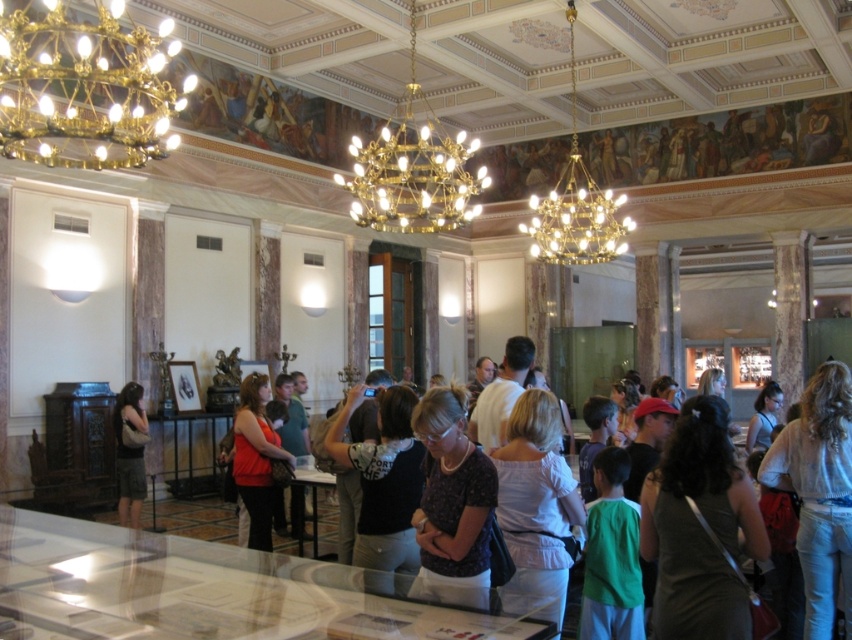
Who is more forward, (530, 579) or (381, 579)?

Point (530, 579) is more forward.

Is white satin blouse at center shorter than dark gray shirt at center?

Yes.

Between point (511, 595) and point (378, 467), which one is positioned in front?

Point (511, 595) is in front.

Locate an element on the screen. white satin blouse at center is located at coordinates (536, 506).

Locate an element on the screen. Image resolution: width=852 pixels, height=640 pixels. white satin blouse at center is located at coordinates (536, 506).

Consider the image. Can you confirm if white satin blouse at center is shorter than dark purple shirt at center?

No, white satin blouse at center is not shorter than dark purple shirt at center.

Where is `white satin blouse at center`? Image resolution: width=852 pixels, height=640 pixels. white satin blouse at center is located at coordinates (536, 506).

Image resolution: width=852 pixels, height=640 pixels. I want to click on white satin blouse at center, so click(x=536, y=506).

Does dark purple shirt at center have a larger size compared to matte red blouse at center?

Incorrect, dark purple shirt at center is not larger than matte red blouse at center.

Consider the image. Can you confirm if dark purple shirt at center is thinner than matte red blouse at center?

Indeed, dark purple shirt at center has a lesser width compared to matte red blouse at center.

What do you see at coordinates (452, 502) in the screenshot? This screenshot has height=640, width=852. I see `dark purple shirt at center` at bounding box center [452, 502].

Where is `dark purple shirt at center`? dark purple shirt at center is located at coordinates (452, 502).